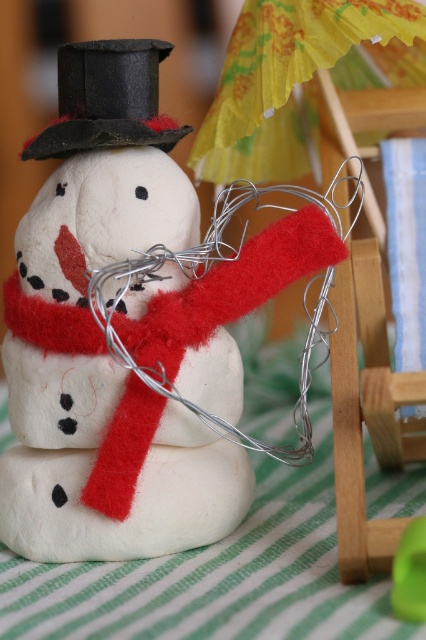
You are a toy collector who wants to display the felt white snowman at center and the black felt hat at upper center on a shelf. The shelf has a height limit of 30 cm. If the snowman is 25 cm tall, will both items fit vertically without exceeding the height limit?

The felt white snowman at center is 25 cm tall, which is under the 30 cm height limit. Since the black felt hat at upper center is shorter than the snowman, both items will fit vertically on the shelf without exceeding the height limit.

You are setting up a winter scene display and need to place both the green striped fabric at lower center and the black felt hat at upper center. Given their sizes, which object would require more horizontal space to accommodate?

The green striped fabric at lower center requires more horizontal space because its width is larger than the black felt hat at upper center.

You are standing in front of the snowman on the green and white striped fabric. There are two points marked in the image. The first point is at coordinates point (x=247, y=598) and the second is at point (x=69, y=100). Which point is closer to you?

Point (x=247, y=598) is in front of point (x=69, y=100), so it is closer to you.